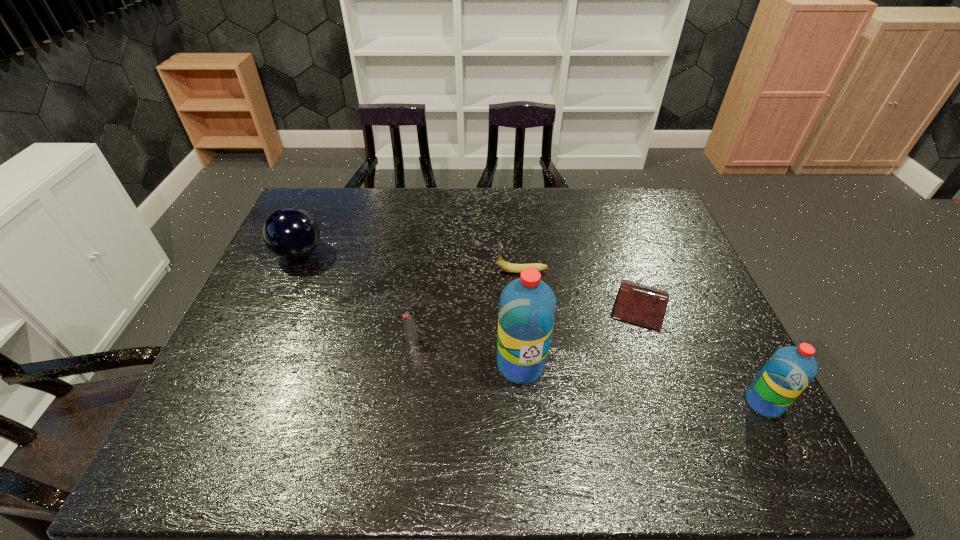
Considering the uniform spacing of water bottles, where should an additional water bottle be positioned on the left? Please locate a free spot. Please provide its 2D coordinates. Your answer should be formatted as a tuple, i.e. [(x, y)], where the tuple contains the x and y coordinates of a point satisfying the conditions above.

[(310, 331)]